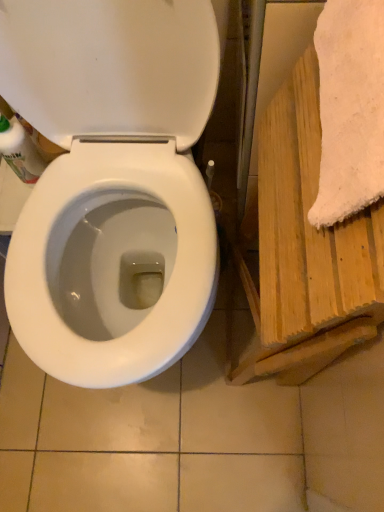
Question: Considering the relative sizes of wooden towel at right and translucent plastic bottle at left in the image provided, is wooden towel at right bigger than translucent plastic bottle at left?

Choices:
 (A) yes
 (B) no

Answer: (A)

Question: Does wooden towel at right have a greater width compared to translucent plastic bottle at left?

Choices:
 (A) yes
 (B) no

Answer: (B)

Question: From a real-world perspective, is wooden towel at right located beneath translucent plastic bottle at left?

Choices:
 (A) no
 (B) yes

Answer: (B)

Question: Can you confirm if wooden towel at right is taller than translucent plastic bottle at left?

Choices:
 (A) yes
 (B) no

Answer: (A)

Question: Does wooden towel at right appear on the left side of translucent plastic bottle at left?

Choices:
 (A) yes
 (B) no

Answer: (B)

Question: Would you say wooden towel at right contains translucent plastic bottle at left?

Choices:
 (A) yes
 (B) no

Answer: (B)

Question: Can you confirm if translucent plastic bottle at left is positioned to the left of white fluffy towel at right?

Choices:
 (A) no
 (B) yes

Answer: (B)

Question: From the image's perspective, would you say translucent plastic bottle at left is shown under white fluffy towel at right?

Choices:
 (A) yes
 (B) no

Answer: (B)

Question: Is translucent plastic bottle at left further to the viewer compared to white fluffy towel at right?

Choices:
 (A) no
 (B) yes

Answer: (B)

Question: Does translucent plastic bottle at left touch white fluffy towel at right?

Choices:
 (A) yes
 (B) no

Answer: (B)

Question: Is translucent plastic bottle at left oriented away from white fluffy towel at right?

Choices:
 (A) no
 (B) yes

Answer: (A)

Question: Is translucent plastic bottle at left wider than white fluffy towel at right?

Choices:
 (A) no
 (B) yes

Answer: (A)

Question: Is white glossy toilet at center far from translucent plastic bottle at left?

Choices:
 (A) yes
 (B) no

Answer: (B)